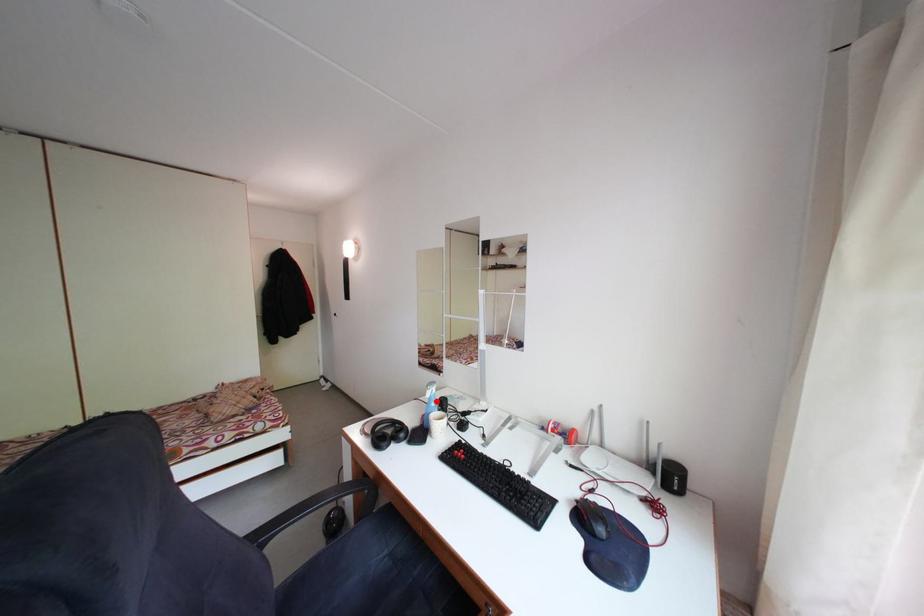
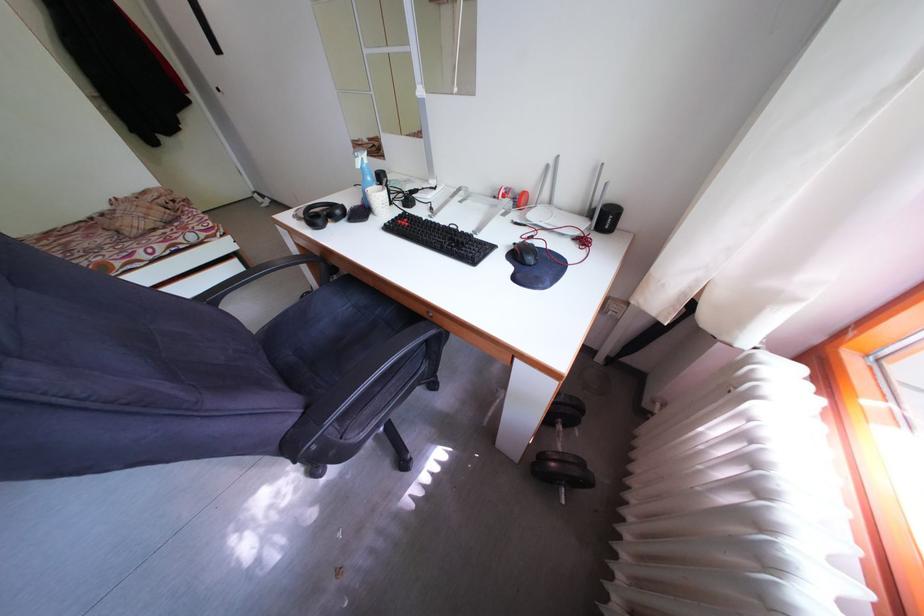
Question: I am providing you with two images of the same scene from different viewpoints. Given a red point in image1, look at the same physical point in image2. Is it:

Choices:
 (A) Closer to the viewpoint
 (B) Farther from the viewpoint

Answer: (B)